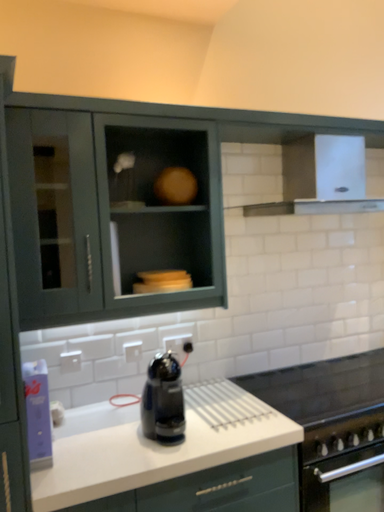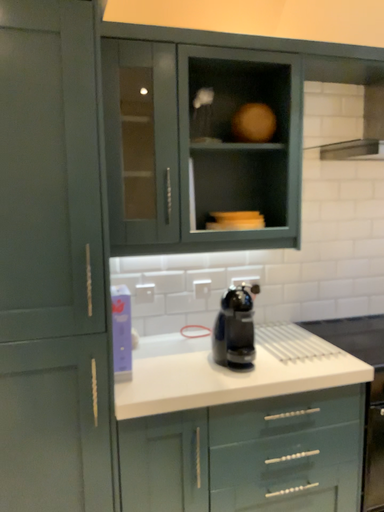
Question: How did the camera likely rotate when shooting the video?

Choices:
 (A) rotated left
 (B) rotated right

Answer: (A)